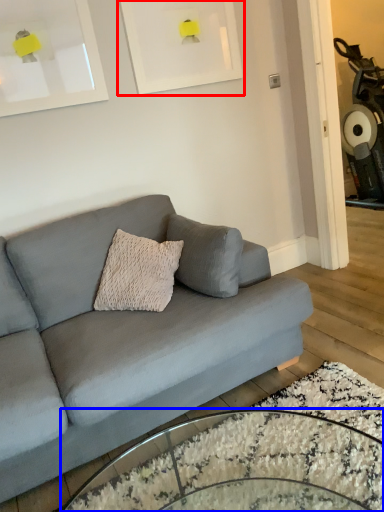
Question: Which point is closer to the camera, picture frame (highlighted by a red box) or coffee table (highlighted by a blue box)?

Choices:
 (A) picture frame
 (B) coffee table

Answer: (B)